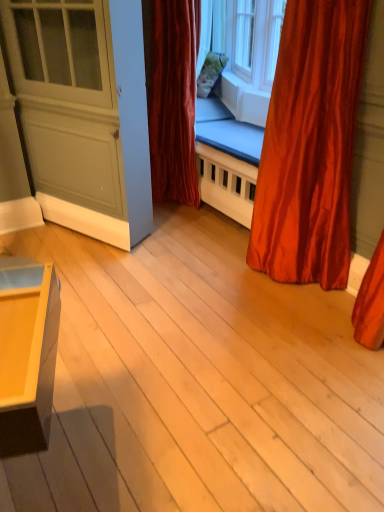
Question: Is matte gray screen door at left beside clear glass window at upper center?

Choices:
 (A) yes
 (B) no

Answer: (B)

Question: Is matte gray screen door at left positioned with its back to clear glass window at upper center?

Choices:
 (A) yes
 (B) no

Answer: (A)

Question: Does matte gray screen door at left have a larger size compared to clear glass window at upper center?

Choices:
 (A) no
 (B) yes

Answer: (B)

Question: Can we say matte gray screen door at left lies outside clear glass window at upper center?

Choices:
 (A) yes
 (B) no

Answer: (A)

Question: Is matte gray screen door at left positioned behind clear glass window at upper center?

Choices:
 (A) yes
 (B) no

Answer: (B)

Question: From a real-world perspective, is matte gray screen door at left physically above clear glass window at upper center?

Choices:
 (A) no
 (B) yes

Answer: (A)

Question: From the image's perspective, is satin red curtain at right, the second curtain from the left, on top of matte gray screen door at left?

Choices:
 (A) no
 (B) yes

Answer: (A)

Question: Is satin red curtain at right, the second curtain from the left, positioned with its back to matte gray screen door at left?

Choices:
 (A) no
 (B) yes

Answer: (A)

Question: Is satin red curtain at right, the second curtain viewed from the back, thinner than matte gray screen door at left?

Choices:
 (A) yes
 (B) no

Answer: (B)

Question: Considering the relative sizes of satin red curtain at right, the second curtain viewed from the back, and matte gray screen door at left in the image provided, is satin red curtain at right, the second curtain viewed from the back, wider than matte gray screen door at left?

Choices:
 (A) no
 (B) yes

Answer: (B)

Question: Is satin red curtain at right, the second curtain from the left, to the right of matte gray screen door at left from the viewer's perspective?

Choices:
 (A) yes
 (B) no

Answer: (A)

Question: Is satin red curtain at right, positioned as the first curtain in right-to-left order, positioned behind matte gray screen door at left?

Choices:
 (A) no
 (B) yes

Answer: (A)

Question: From a real-world perspective, does clear glass window at upper center stand above satin red curtain at right, marked as the 1th curtain in a front-to-back arrangement?

Choices:
 (A) no
 (B) yes

Answer: (B)